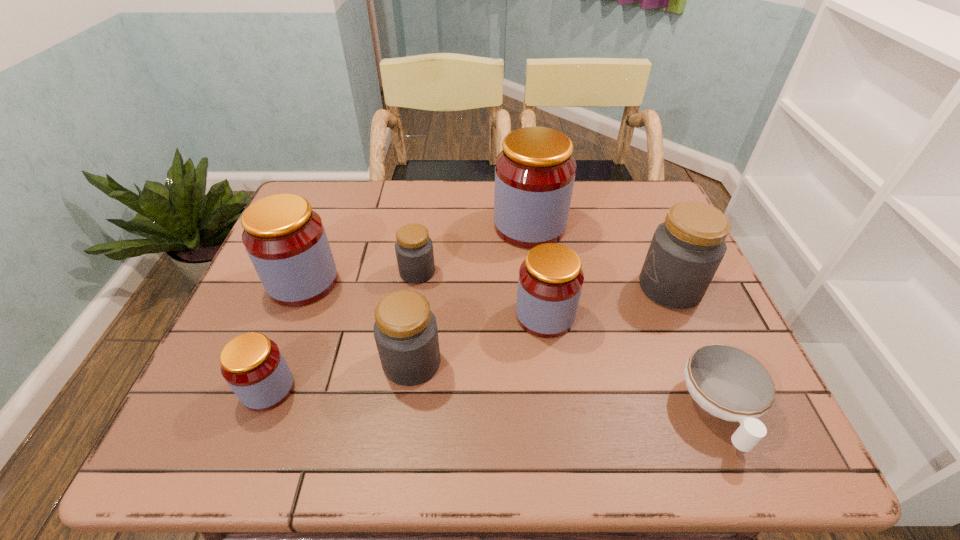
You are a GUI agent. You are given a task and a screenshot of the screen. Output one action in this format:
    pyautogui.click(x=<x>, y=<y>)
    Task: Click on the free space that is in between the nearest red jar and the white chinaware
    The image size is (960, 540).
    Given the screenshot: What is the action you would take?
    pyautogui.click(x=493, y=399)

Image resolution: width=960 pixels, height=540 pixels. Identify the location of empty location between the second smallest red jar and the rightmost jar. (608, 301).

Identify the location of unoccupied area between the smallest red jar and the second biggest gray jar. This screenshot has width=960, height=540. (x=340, y=376).

Identify the location of free space between the farthest red jar and the chinaware. (624, 318).

What are the coordinates of `free space that is in between the nearest gray jar and the second smallest red jar` in the screenshot? It's located at (478, 339).

Find the location of a particular element. Image resolution: width=960 pixels, height=540 pixels. free space between the shortest object and the nearest red jar is located at coordinates (493, 399).

Find the location of a particular element. The width and height of the screenshot is (960, 540). free space between the biggest gray jar and the second smallest red jar is located at coordinates (608, 301).

The height and width of the screenshot is (540, 960). What are the coordinates of `empty location between the third biggest red jar and the nearest gray jar` in the screenshot? It's located at (478, 339).

Image resolution: width=960 pixels, height=540 pixels. What are the coordinates of `vacant region between the nearest red jar and the rightmost jar` in the screenshot? It's located at (469, 338).

Point out which object is positioned as the second nearest to the smallest red jar. Please provide its 2D coordinates. Your answer should be formatted as a tuple, i.e. [(x, y)], where the tuple contains the x and y coordinates of a point satisfying the conditions above.

[(405, 330)]